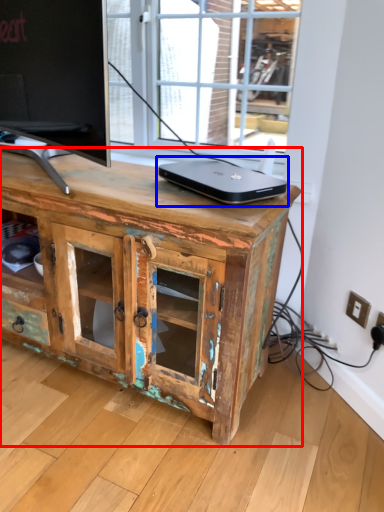
Question: Among these objects, which one is nearest to the camera, chest of drawers (highlighted by a red box) or laptop (highlighted by a blue box)?

Choices:
 (A) chest of drawers
 (B) laptop

Answer: (A)